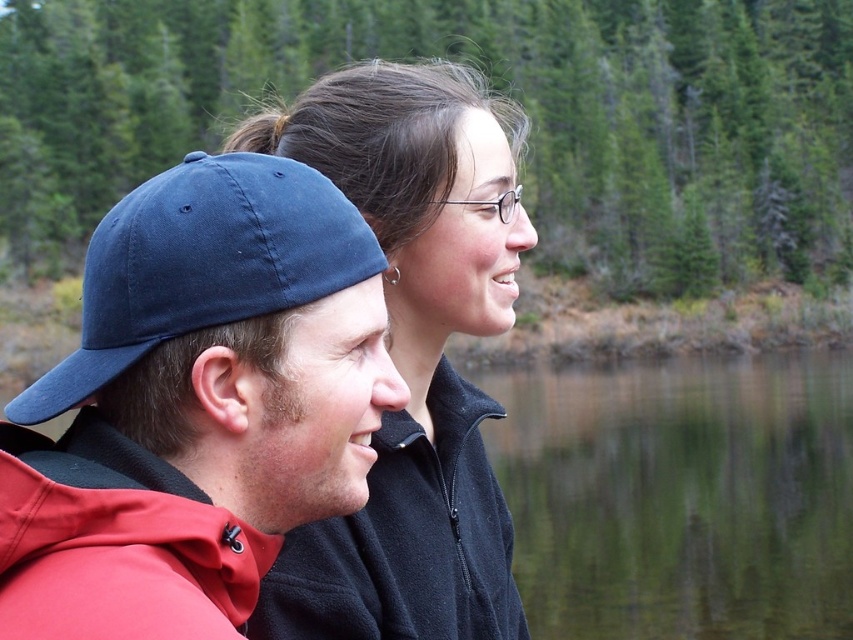
From the picture: You are a photographer trying to capture a group photo of the matte black jacket at center and the navy blue fabric baseball cap at left. The camera you are using has a minimum focusing distance of 5 feet. Will you be able to take a clear photo of both subjects without moving either of them?

The matte black jacket at center and navy blue fabric baseball cap at left are 4.71 feet apart from each other. Since the camera requires a minimum focusing distance of 5 feet to capture both subjects clearly, the distance between them is insufficient. You will need to move them farther apart or use a different camera setting to ensure both are in focus.

You are taking a photo of two people standing in a forest near a lake. The two points in the image are labeled as point (844,353) and point (155,259). If you want to focus on the person closer to the camera, which point should you adjust your camera focus to?

Point (155,259) is closer to the camera than point (844,353), so you should focus on point (155,259) to capture the person closer to the camera.

You are a photographer trying to capture both the matte black jacket at center and the navy blue fabric baseball cap at left in a single frame. Based on their positions, which object is positioned further to the right?

The matte black jacket at center is positioned further to the right than the navy blue fabric baseball cap at left.